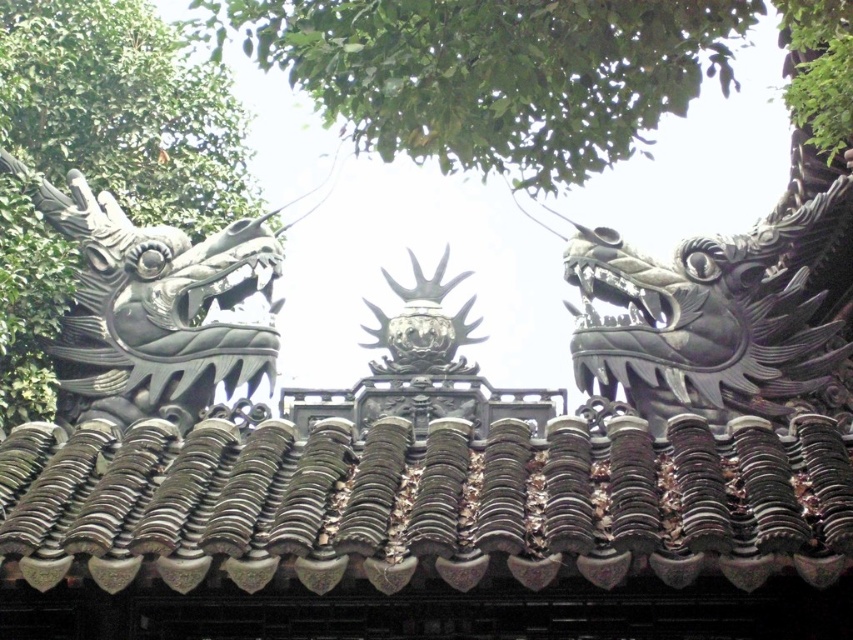
Question: Among these points, which one is nearest to the camera?

Choices:
 (A) (608, 570)
 (B) (706, 291)
 (C) (727, 64)

Answer: (A)

Question: Which point appears closest to the camera in this image?

Choices:
 (A) (637, 346)
 (B) (619, 22)
 (C) (705, 468)

Answer: (C)

Question: Does green leafy tree at upper center have a smaller size compared to shiny black dragon at right?

Choices:
 (A) yes
 (B) no

Answer: (B)

Question: Can you confirm if shiny black dragon at right is thinner than black matte dragon head at left?

Choices:
 (A) yes
 (B) no

Answer: (B)

Question: Which object appears closest to the camera in this image?

Choices:
 (A) dark gray textured tiles at center
 (B) green leafy tree at upper center

Answer: (A)

Question: Is green leafy tree at upper center to the right of shiny black dragon at right from the viewer's perspective?

Choices:
 (A) no
 (B) yes

Answer: (A)